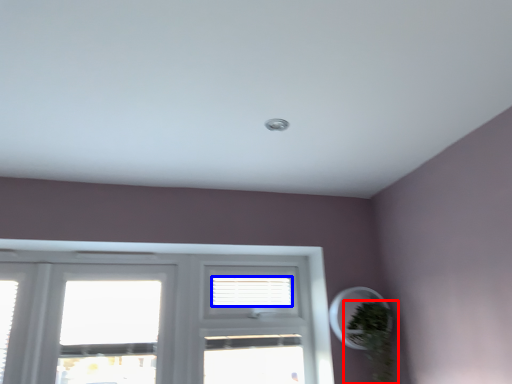
Question: Which point is further to the camera, houseplant (highlighted by a red box) or blind (highlighted by a blue box)?

Choices:
 (A) houseplant
 (B) blind

Answer: (B)